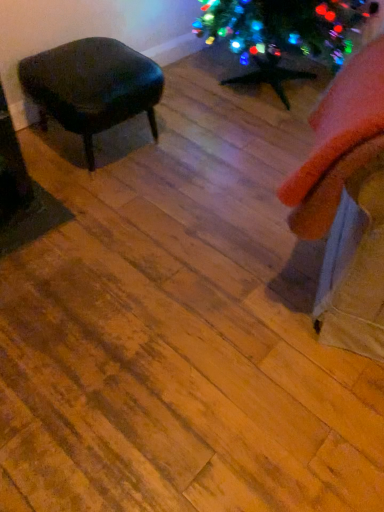
Question: From a real-world perspective, is orange fabric swivel chair at right located higher than matte black stool at left?

Choices:
 (A) yes
 (B) no

Answer: (A)

Question: Is orange fabric swivel chair at right outside matte black stool at left?

Choices:
 (A) no
 (B) yes

Answer: (B)

Question: Is orange fabric swivel chair at right oriented away from matte black stool at left?

Choices:
 (A) yes
 (B) no

Answer: (B)

Question: Are orange fabric swivel chair at right and matte black stool at left making contact?

Choices:
 (A) yes
 (B) no

Answer: (B)

Question: Is orange fabric swivel chair at right smaller than matte black stool at left?

Choices:
 (A) yes
 (B) no

Answer: (A)

Question: From the image's perspective, is orange fabric swivel chair at right located beneath matte black stool at left?

Choices:
 (A) no
 (B) yes

Answer: (B)

Question: Can you confirm if matte black stool at left is positioned to the left of orange fabric swivel chair at right?

Choices:
 (A) no
 (B) yes

Answer: (B)

Question: Does matte black stool at left have a lesser height compared to orange fabric swivel chair at right?

Choices:
 (A) no
 (B) yes

Answer: (B)

Question: Is matte black stool at left oriented away from orange fabric swivel chair at right?

Choices:
 (A) yes
 (B) no

Answer: (B)

Question: From a real-world perspective, is matte black stool at left located beneath orange fabric swivel chair at right?

Choices:
 (A) no
 (B) yes

Answer: (B)

Question: Does matte black stool at left turn towards orange fabric swivel chair at right?

Choices:
 (A) yes
 (B) no

Answer: (A)

Question: Is matte black stool at left thinner than orange fabric swivel chair at right?

Choices:
 (A) no
 (B) yes

Answer: (A)

Question: Which is correct: orange fabric swivel chair at right is inside matte black stool at left, or outside of it?

Choices:
 (A) inside
 (B) outside

Answer: (B)